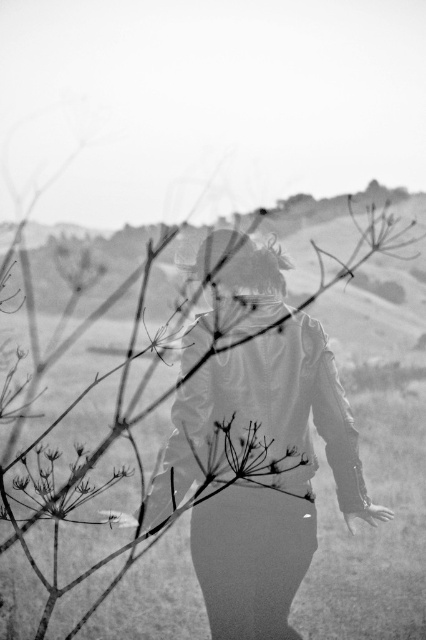
You are navigating through a natural landscape and see two points marked in the image. The first point is at coordinates point (267, 531) and the second is at point (28, 506). Which point is closer to your current position if you are standing at the same position as the camera?

Point (267, 531) is in front of point (28, 506), so it is closer to your current position at the camera.

You are an observer looking at the scene. Which object, the matte leather jacket at center or the silvery metallic flower at lower left, is smaller in size?

The matte leather jacket at center is smaller in size compared to the silvery metallic flower at lower left.

Consider the image. You are a photographer trying to capture the matte leather jacket at center without any obstruction. Can you see the silvery metallic flower at lower left through the branches in the foreground?

The silvery metallic flower at lower left is behind the matte leather jacket at center, so it would be obscured by the branches in the foreground, making it difficult to see.